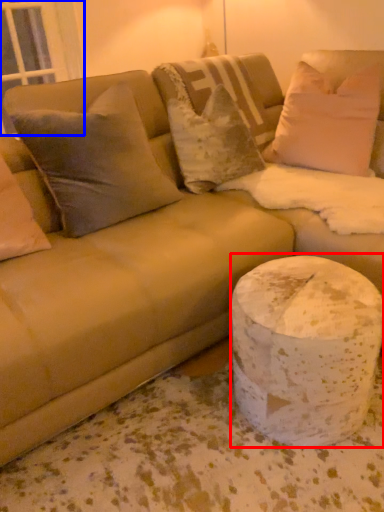
Question: Which object is closer to the camera taking this photo, marble (highlighted by a red box) or window screen (highlighted by a blue box)?

Choices:
 (A) marble
 (B) window screen

Answer: (A)